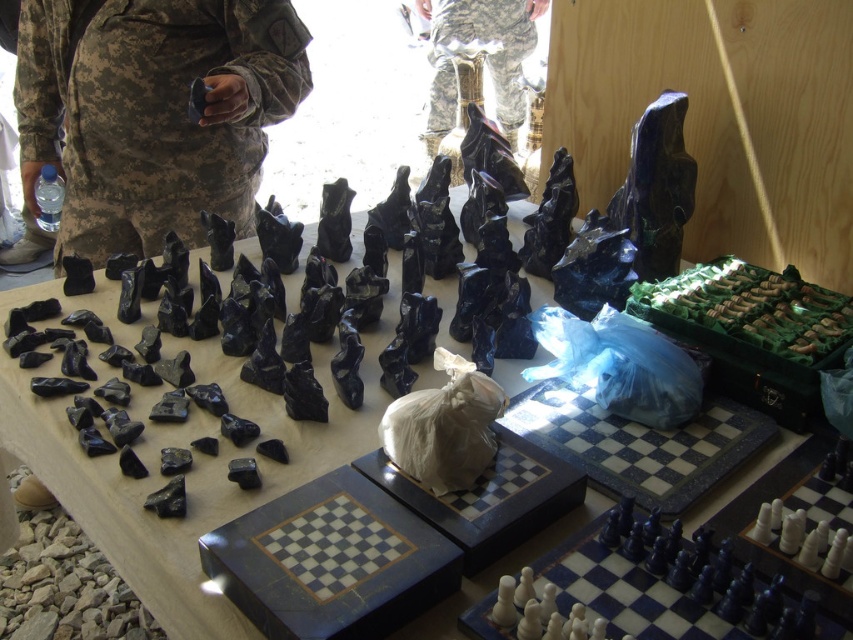
Question: Which object is farther from the camera taking this photo?

Choices:
 (A) camouflage fabric pants at center
 (B) camouflage fabric uniform at center

Answer: (A)

Question: Can you confirm if black stone chess pieces at center is positioned to the right of camouflage fabric uniform at center?

Choices:
 (A) no
 (B) yes

Answer: (B)

Question: Which of the following is the farthest from the observer?

Choices:
 (A) (424, 368)
 (B) (236, 202)

Answer: (B)

Question: Can you confirm if camouflage fabric uniform at center is smaller than camouflage fabric pants at center?

Choices:
 (A) no
 (B) yes

Answer: (B)

Question: Can you confirm if black stone chess pieces at center is positioned to the left of camouflage fabric pants at center?

Choices:
 (A) no
 (B) yes

Answer: (B)

Question: Which point is closer to the camera?

Choices:
 (A) black stone chess pieces at center
 (B) camouflage fabric uniform at center

Answer: (A)